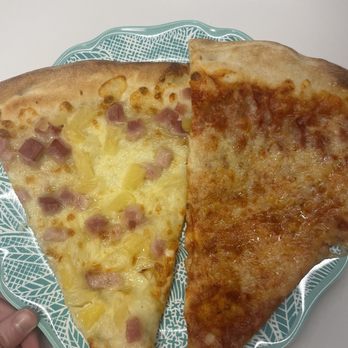
I want to click on edge of green plate, so click(x=131, y=50), click(x=37, y=292), click(x=291, y=319).